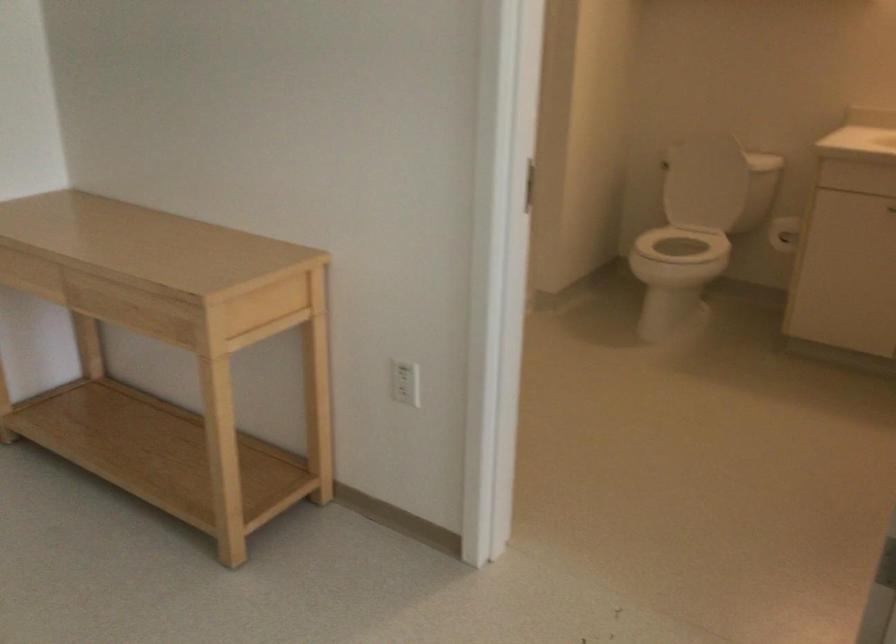
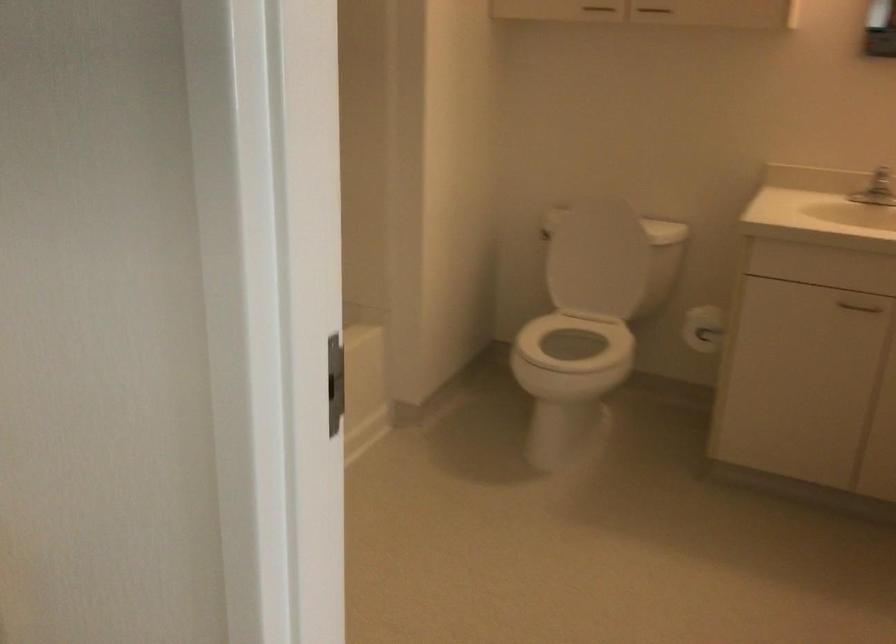
Find the pixel in the second image that matches point 713,174 in the first image.

(596, 258)